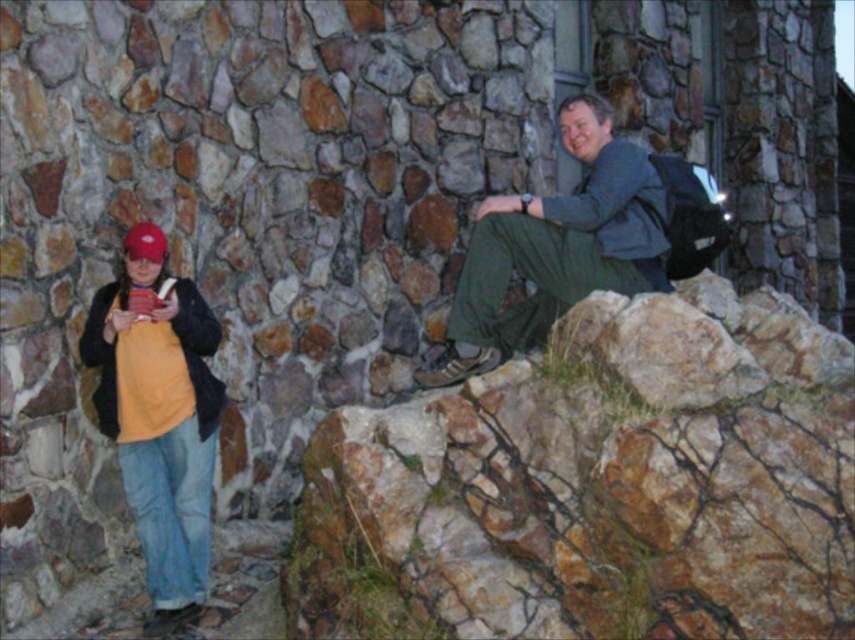
Question: Can you confirm if brown rough rock at upper right is positioned below matte yellow shirt at left?

Choices:
 (A) yes
 (B) no

Answer: (A)

Question: Is brown rough rock at upper right bigger than dark green fabric pants at upper right?

Choices:
 (A) no
 (B) yes

Answer: (B)

Question: Which object is closer to the camera taking this photo?

Choices:
 (A) yellow fleece at left
 (B) matte yellow shirt at left
 (C) dark green fabric pants at upper right
 (D) brown rough rock at upper right

Answer: (D)

Question: Is matte yellow shirt at left smaller than dark green fabric pants at upper right?

Choices:
 (A) yes
 (B) no

Answer: (A)

Question: Which of the following is the closest to the observer?

Choices:
 (A) brown rough rock at upper right
 (B) yellow fleece at left
 (C) matte yellow shirt at left

Answer: (A)

Question: Among these points, which one is nearest to the camera?

Choices:
 (A) (629, 342)
 (B) (193, 589)
 (C) (199, 413)
 (D) (476, 250)

Answer: (A)